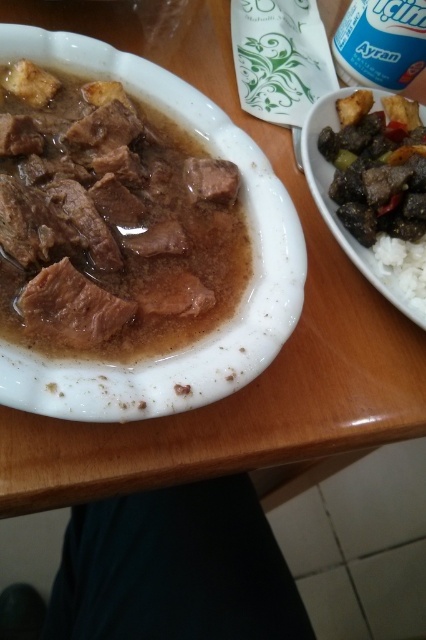
You are a food critic evaluating the presentation of two dishes. The first dish has brown glossy meat at left, and the second has brown glossy meat at upper right. Which dish has meat that is taller in height?

The brown glossy meat at left is taller than the brown glossy meat at upper right, so the first dish has taller meat.

You are a food critic evaluating this dish. You notice a piece of meat at point (377, 166). Based on its appearance, what is the texture of this brown glossy meat at upper right?

Result: The brown glossy meat at upper right has a tender and moist texture, as it is submerged in a rich brown sauce and appears to have been cooked for an extended period, resulting in a tender consistency.